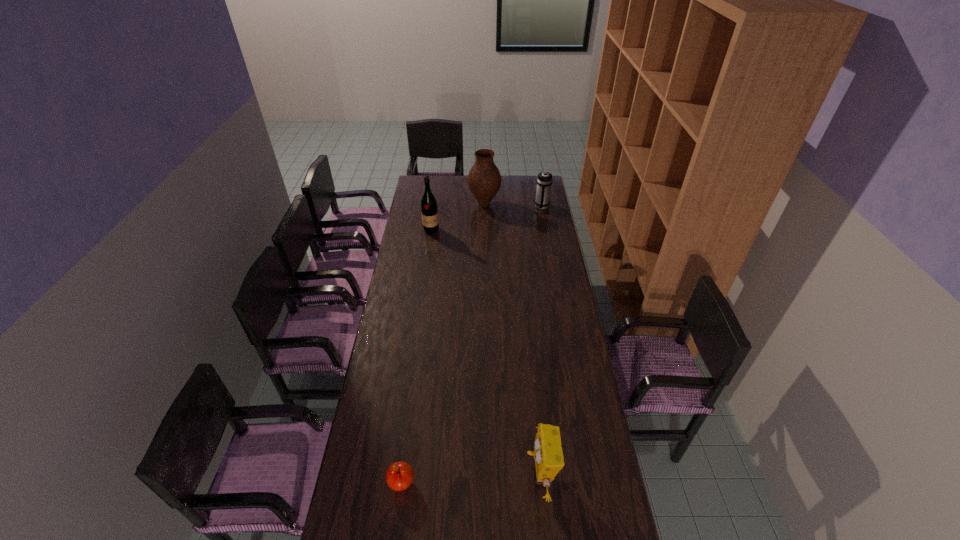
Where is `object that is the closest to the liquor`? Image resolution: width=960 pixels, height=540 pixels. object that is the closest to the liquor is located at coordinates (484, 180).

Find the location of `free location that satisfies the following two spatial constraints: 1. on the front-facing side of the shortest object; 2. on the right side of the third nearest object`. free location that satisfies the following two spatial constraints: 1. on the front-facing side of the shortest object; 2. on the right side of the third nearest object is located at coordinates (396, 483).

Locate an element on the screen. vacant area in the image that satisfies the following two spatial constraints: 1. on the front-facing side of the apple; 2. on the left side of the third nearest object is located at coordinates (396, 483).

What are the coordinates of `free space that satisfies the following two spatial constraints: 1. on the side with the handle of the rightmost object; 2. on the face of the sponge` in the screenshot? It's located at (592, 475).